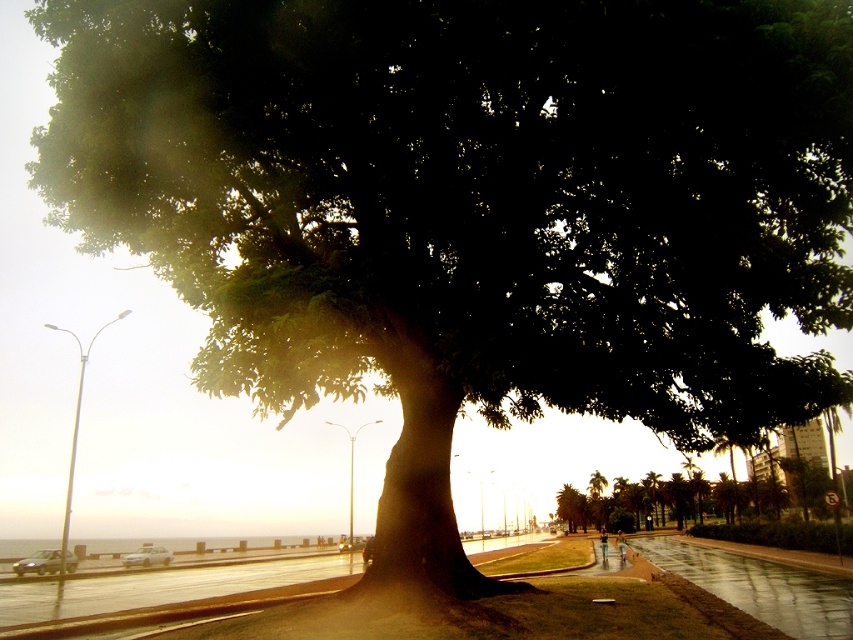
Question: Among these objects, which one is farthest from the camera?

Choices:
 (A) matte silver car at lower left
 (B) white glossy car at center

Answer: (B)

Question: In this image, where is matte silver car at lower left located relative to white glossy car at center?

Choices:
 (A) above
 (B) below

Answer: (A)

Question: Can you confirm if matte silver car at lower left is smaller than white glossy car at center?

Choices:
 (A) no
 (B) yes

Answer: (A)

Question: Can you confirm if matte silver car at lower left is positioned to the left of white glossy car at center?

Choices:
 (A) yes
 (B) no

Answer: (A)

Question: Which point is closer to the camera taking this photo?

Choices:
 (A) (38, 563)
 (B) (125, 560)

Answer: (A)